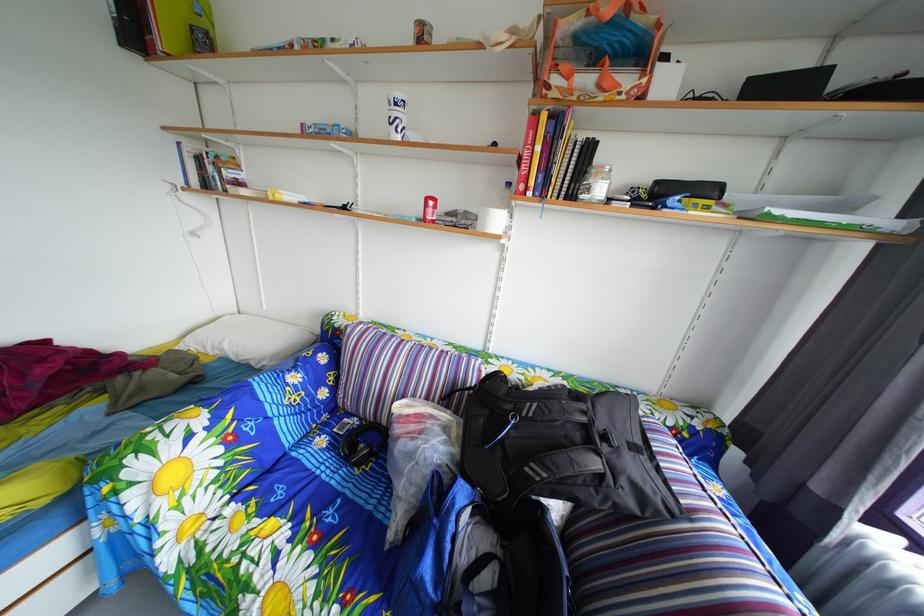
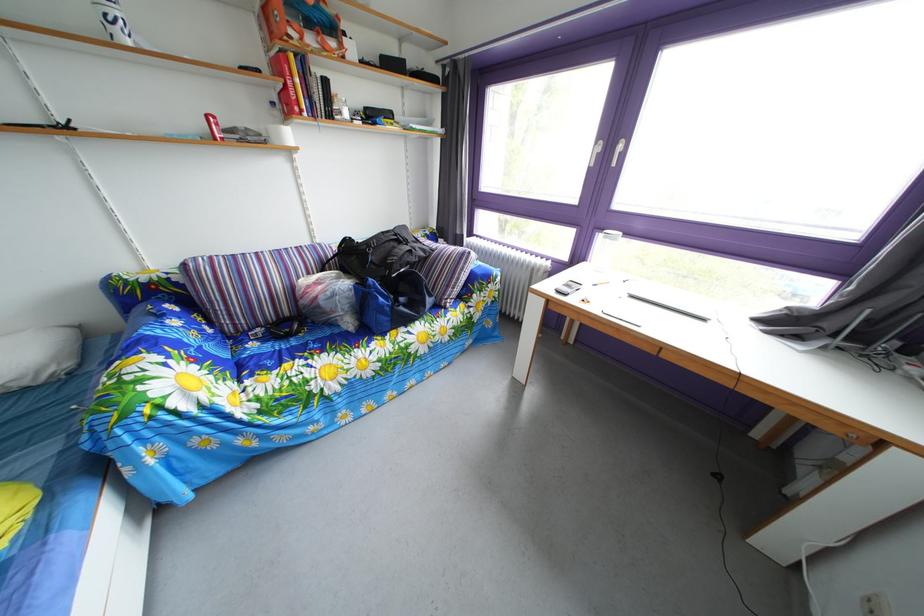
In the second image, find the point that corresponds to point 519,193 in the first image.

(284, 111)